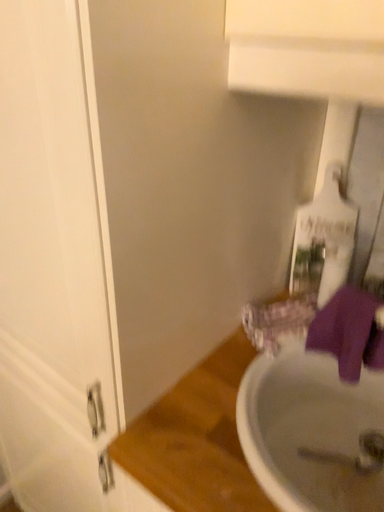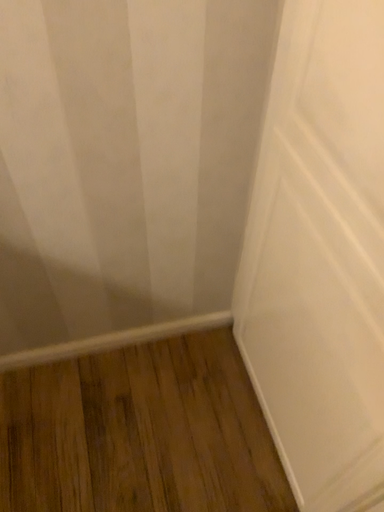
Question: How did the camera likely rotate when shooting the video?

Choices:
 (A) rotated right
 (B) rotated left

Answer: (B)